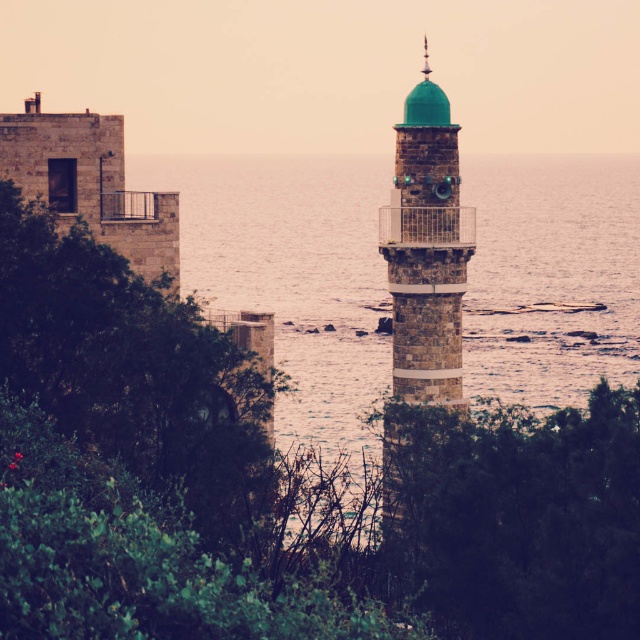
Is point (497, 433) less distant than point (60, 346)?

That is True.

Which of these two, green leafy bush at center or green leafy tree at left, stands taller?

green leafy tree at left

Where is `green leafy bush at center`? This screenshot has width=640, height=640. green leafy bush at center is located at coordinates (516, 516).

Locate an element on the screen. This screenshot has height=640, width=640. green leafy bush at center is located at coordinates (516, 516).

Who is lower down, green leafy bush at center or green stone minaret at center?

green stone minaret at center is below.

Does point (620, 528) lie in front of point (396, 305)?

That is True.

This screenshot has height=640, width=640. Find the location of `green leafy bush at center`. green leafy bush at center is located at coordinates click(x=516, y=516).

Between smooth stone water at center and green leafy bush at center, which one is positioned higher?

smooth stone water at center

Is point (620, 362) farther from camera compared to point (586, 499)?

Yes, point (620, 362) is behind point (586, 499).

Is point (472, 310) positioned after point (536, 508)?

Yes, it is behind point (536, 508).

Locate an element on the screen. The height and width of the screenshot is (640, 640). smooth stone water at center is located at coordinates (292, 273).